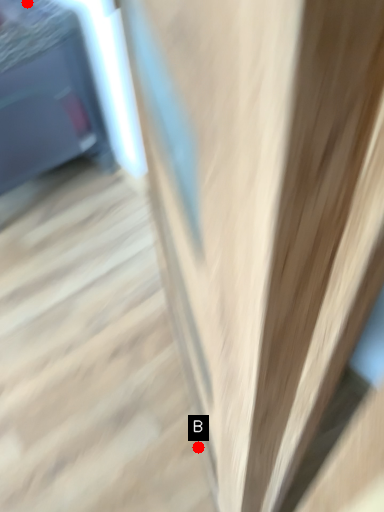
Question: Two points are circled on the image, labeled by A and B beside each circle. Which point appears closest to the camera in this image?

Choices:
 (A) A is closer
 (B) B is closer

Answer: (B)